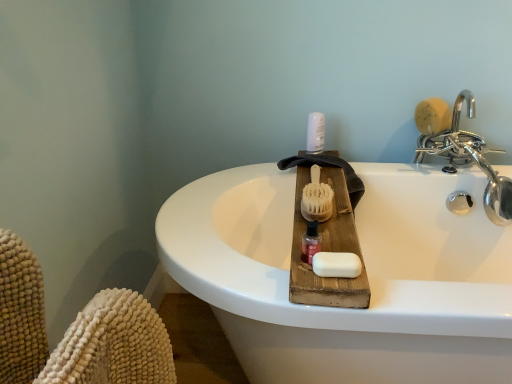
Identify the location of free space in front of white plastic bottle at upper center. (323, 157).